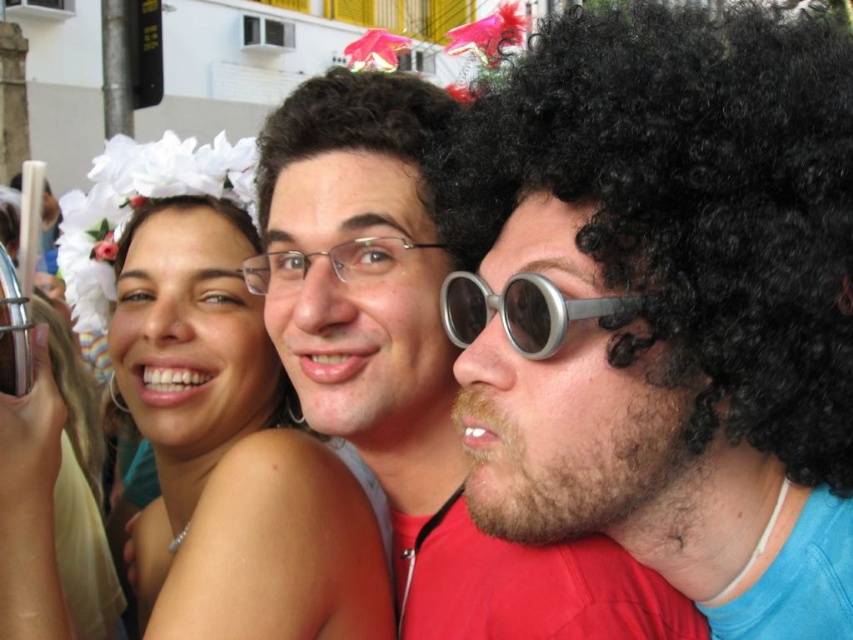
Question: Is dark curly hair at center above metallic silver goggles at center?

Choices:
 (A) yes
 (B) no

Answer: (A)

Question: Estimate the real-world distances between objects in this image. Which object is closer to the dark curly hair at center?

Choices:
 (A) metallic silver goggles at center
 (B) matte black glasses at center
 (C) black curly wig at right
 (D) smooth skin at center

Answer: (B)

Question: Which object appears closest to the camera in this image?

Choices:
 (A) smooth skin at center
 (B) dark curly hair at center
 (C) smooth skin face at center

Answer: (C)

Question: From the image, what is the correct spatial relationship of smooth skin face at center in relation to smooth skin at center?

Choices:
 (A) right
 (B) left

Answer: (A)

Question: Is the position of dark curly hair at center less distant than that of metallic silver goggles at center?

Choices:
 (A) no
 (B) yes

Answer: (A)

Question: Which object appears closest to the camera in this image?

Choices:
 (A) dark curly hair at center
 (B) black curly wig at right
 (C) smooth skin face at center

Answer: (B)